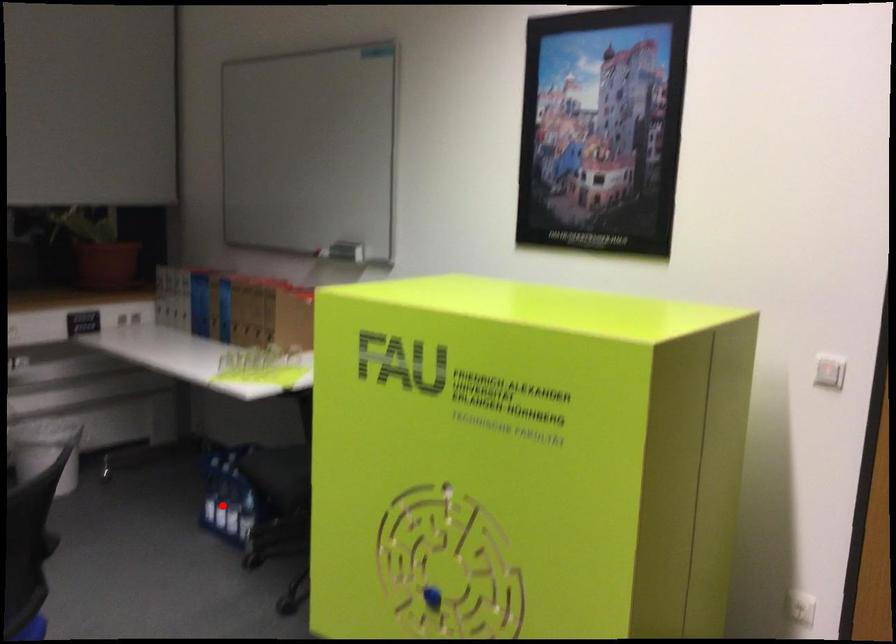
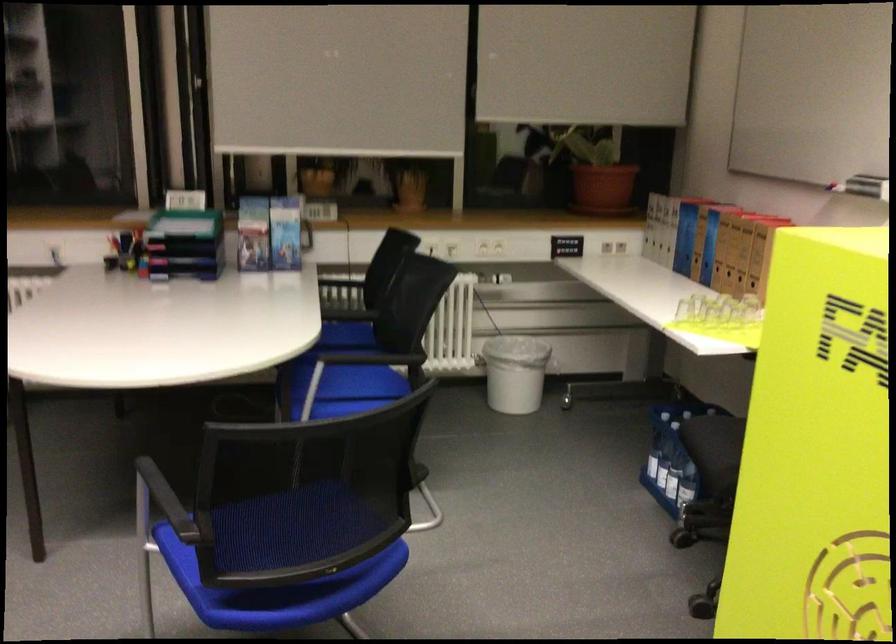
Find the pixel in the second image that matches the highlighted location in the first image.

(661, 465)